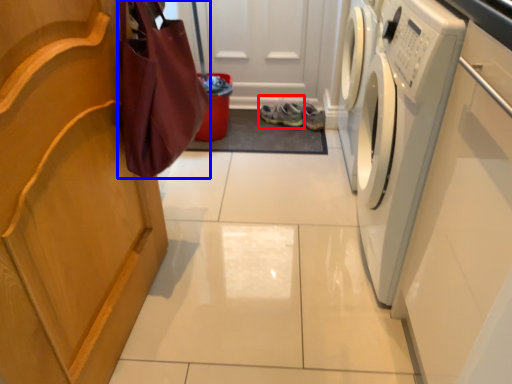
Question: Which object appears closest to the camera in this image, footwear (highlighted by a red box) or shopping bag (highlighted by a blue box)?

Choices:
 (A) footwear
 (B) shopping bag

Answer: (B)